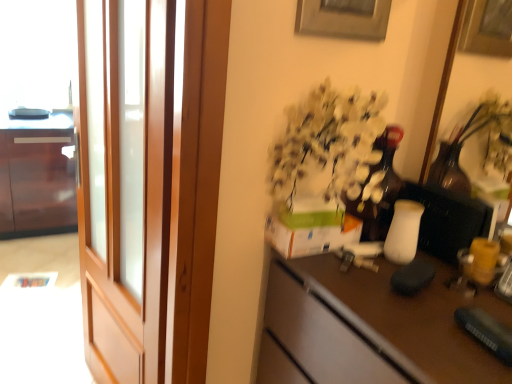
Question: Considering the relative positions of wooden screen door at left and glossy wood cabinet at left in the image provided, is wooden screen door at left to the left or to the right of glossy wood cabinet at left?

Choices:
 (A) left
 (B) right

Answer: (B)

Question: Is wooden screen door at left taller or shorter than glossy wood cabinet at left?

Choices:
 (A) short
 (B) tall

Answer: (B)

Question: Estimate the real-world distances between objects in this image. Which object is farther from the brown matte desk at center?

Choices:
 (A) wooden screen door at left
 (B) glossy wood cabinet at left

Answer: (B)

Question: Estimate the real-world distances between objects in this image. Which object is farther from the glossy wood cabinet at left?

Choices:
 (A) wooden screen door at left
 (B) brown matte desk at center

Answer: (B)